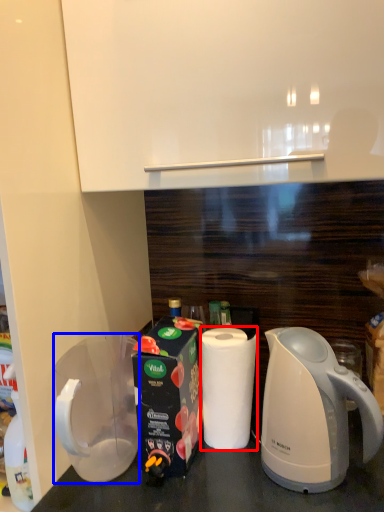
Question: Among these objects, which one is farthest to the camera, paper towel (highlighted by a red box) or pitcher (highlighted by a blue box)?

Choices:
 (A) paper towel
 (B) pitcher

Answer: (A)